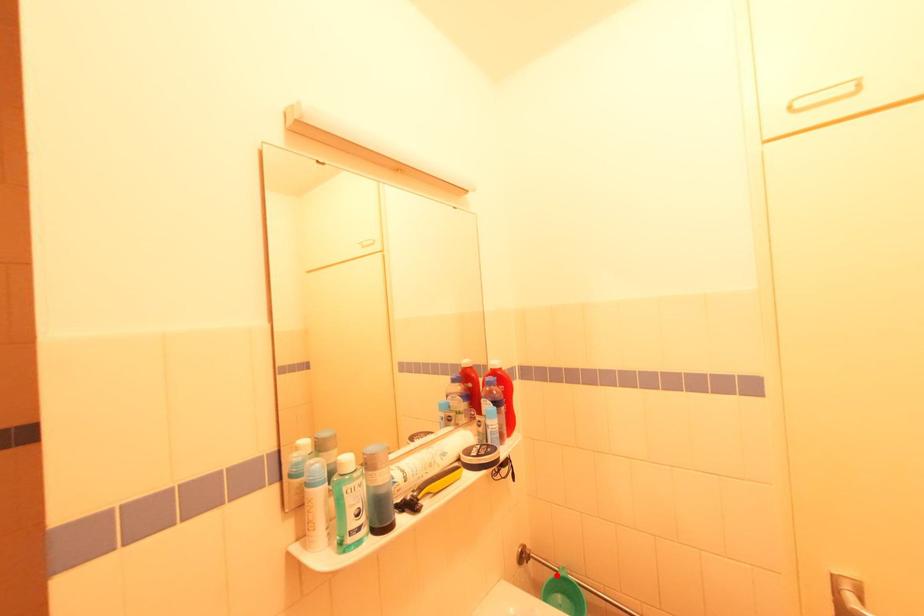
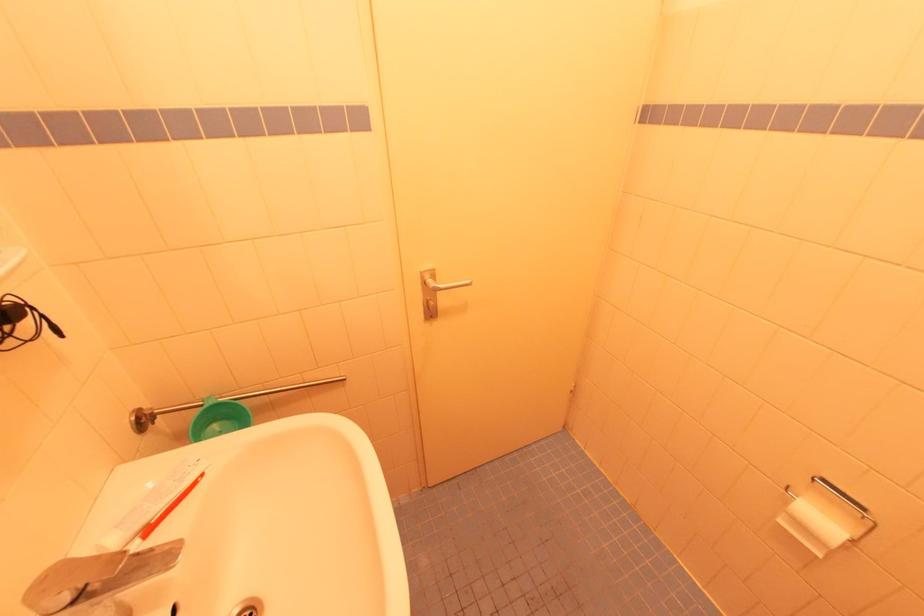
The point at the highlighted location is marked in the first image. Where is the corresponding point in the second image?

(201, 411)